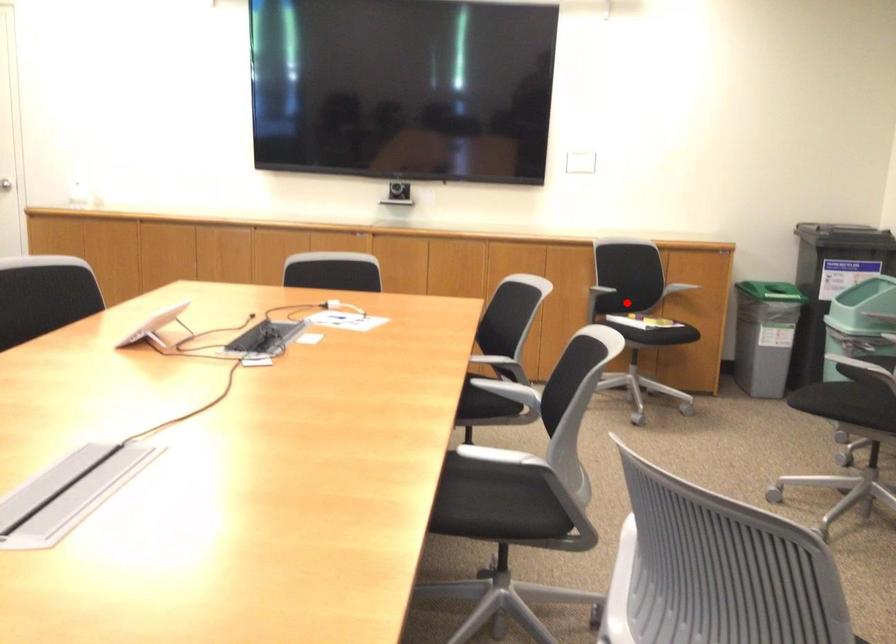
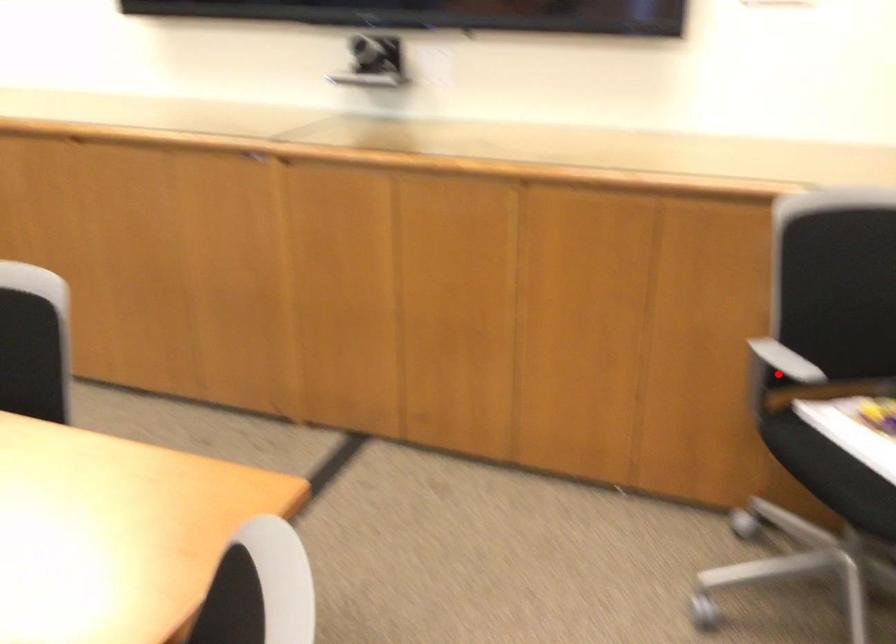
I am providing you with two images of the same scene from different viewpoints. A red point is marked on the first image and another point is marked on the second image. Are the points marked in image1 and image2 representing the same 3D position?

No